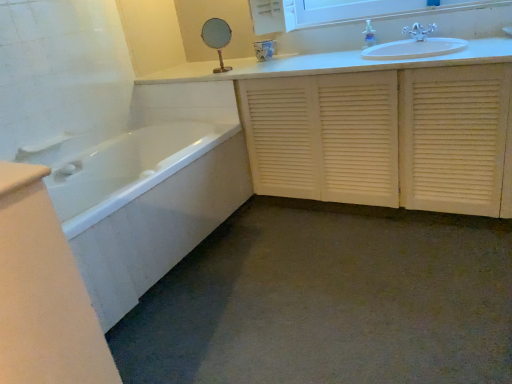
Question: Should I look upward or downward to see clear plastic soap dispenser at upper center?

Choices:
 (A) down
 (B) up

Answer: (B)

Question: Is the depth of silver metallic faucet at upper right greater than that of white plastic towel bar at left?

Choices:
 (A) no
 (B) yes

Answer: (B)

Question: Considering the relative sizes of silver metallic faucet at upper right and white plastic towel bar at left in the image provided, is silver metallic faucet at upper right wider than white plastic towel bar at left?

Choices:
 (A) no
 (B) yes

Answer: (B)

Question: Considering the relative sizes of silver metallic faucet at upper right and white plastic towel bar at left in the image provided, is silver metallic faucet at upper right bigger than white plastic towel bar at left?

Choices:
 (A) yes
 (B) no

Answer: (A)

Question: Is silver metallic faucet at upper right closer to the viewer compared to white plastic towel bar at left?

Choices:
 (A) no
 (B) yes

Answer: (A)

Question: Is silver metallic faucet at upper right not within white plastic towel bar at left?

Choices:
 (A) no
 (B) yes

Answer: (B)

Question: Is white plastic towel bar at left surrounded by silver metallic faucet at upper right?

Choices:
 (A) no
 (B) yes

Answer: (A)

Question: Is white louvered cabinet at center located outside silver metallic faucet at upper right?

Choices:
 (A) yes
 (B) no

Answer: (A)

Question: Is white louvered cabinet at center positioned far away from silver metallic faucet at upper right?

Choices:
 (A) yes
 (B) no

Answer: (B)

Question: From the image's perspective, is white louvered cabinet at center on silver metallic faucet at upper right?

Choices:
 (A) yes
 (B) no

Answer: (B)

Question: Could silver metallic faucet at upper right be considered to be inside white louvered cabinet at center?

Choices:
 (A) yes
 (B) no

Answer: (B)

Question: Is white louvered cabinet at center facing away from silver metallic faucet at upper right?

Choices:
 (A) no
 (B) yes

Answer: (A)

Question: Does white louvered cabinet at center have a greater height compared to silver metallic faucet at upper right?

Choices:
 (A) yes
 (B) no

Answer: (A)

Question: Considering the relative sizes of white glossy medicine cabinet at upper center and clear plastic soap dispenser at upper center in the image provided, is white glossy medicine cabinet at upper center wider than clear plastic soap dispenser at upper center?

Choices:
 (A) no
 (B) yes

Answer: (B)